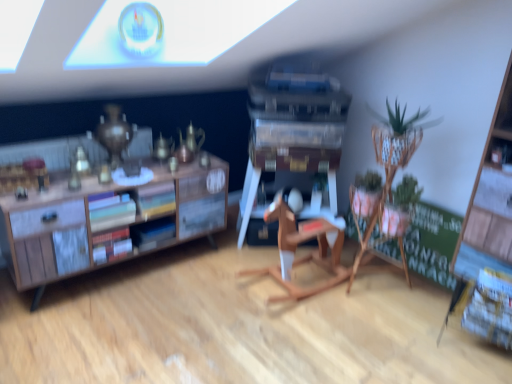
Question: Would you say green woven basket at upper right is to the left or to the right of matte hardcover books at center left, placed as the 1th book when sorted from top to bottom, in the picture?

Choices:
 (A) left
 (B) right

Answer: (B)

Question: Is green woven basket at upper right spatially inside matte hardcover books at center left, placed as the 1th book when sorted from top to bottom, or outside of it?

Choices:
 (A) outside
 (B) inside

Answer: (A)

Question: Based on their relative distances, which object is farther from the green chalkboard at right?

Choices:
 (A) blue matte book at center, positioned as the 2th book in top-to-bottom order
 (B) matte hardcover books at center left, which appears as the second book when ordered from the bottom
 (C) wooden rocking horse at center
 (D) green woven basket at upper right

Answer: (B)

Question: Which object is positioned farthest from the green chalkboard at right?

Choices:
 (A) matte hardcover books at center left, which appears as the second book when ordered from the bottom
 (B) green woven basket at upper right
 (C) blue matte book at center, positioned as the 2th book in top-to-bottom order
 (D) wooden rocking horse at center

Answer: (A)